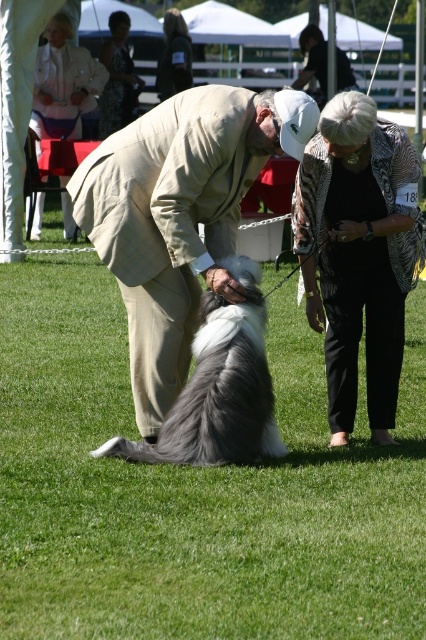
Based on the photo, can you confirm if black textured jacket at center is positioned to the right of smooth black jacket at upper center?

Yes, black textured jacket at center is to the right of smooth black jacket at upper center.

Is black textured jacket at center closer to camera compared to smooth black jacket at upper center?

Yes, it is.

Does point (397, 358) come closer to viewer compared to point (172, 61)?

Yes, it is.

This screenshot has height=640, width=426. I want to click on black textured jacket at center, so click(x=359, y=253).

Is point (175, 29) farther from camera compared to point (310, 65)?

Yes, point (175, 29) is behind point (310, 65).

Is smooth black jacket at upper center to the right of khaki suit at center from the viewer's perspective?

No, smooth black jacket at upper center is not to the right of khaki suit at center.

Measure the distance between smooth black jacket at upper center and camera.

smooth black jacket at upper center and camera are 19.41 meters apart.

Image resolution: width=426 pixels, height=640 pixels. I want to click on smooth black jacket at upper center, so click(173, 56).

Does gray woolen dog at center have a greater width compared to khaki suit at center?

In fact, gray woolen dog at center might be narrower than khaki suit at center.

Which is in front, point (195, 385) or point (337, 77)?

Point (195, 385) is more forward.

I want to click on gray woolen dog at center, so click(x=218, y=388).